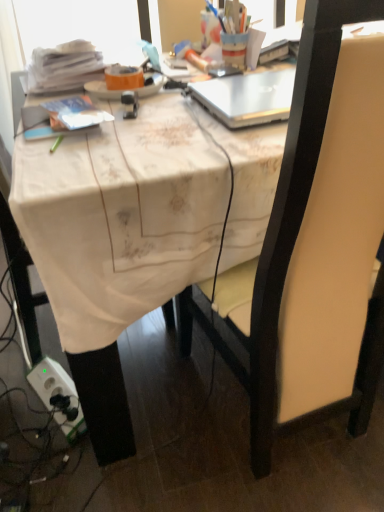
You are a GUI agent. You are given a task and a screenshot of the screen. Output one action in this format:
    pyautogui.click(x=<x>, y=<y>)
    Task: Click on the free region on the left part of silver metallic laptop at upper center
    This screenshot has width=384, height=512.
    Given the screenshot: What is the action you would take?
    pyautogui.click(x=162, y=123)